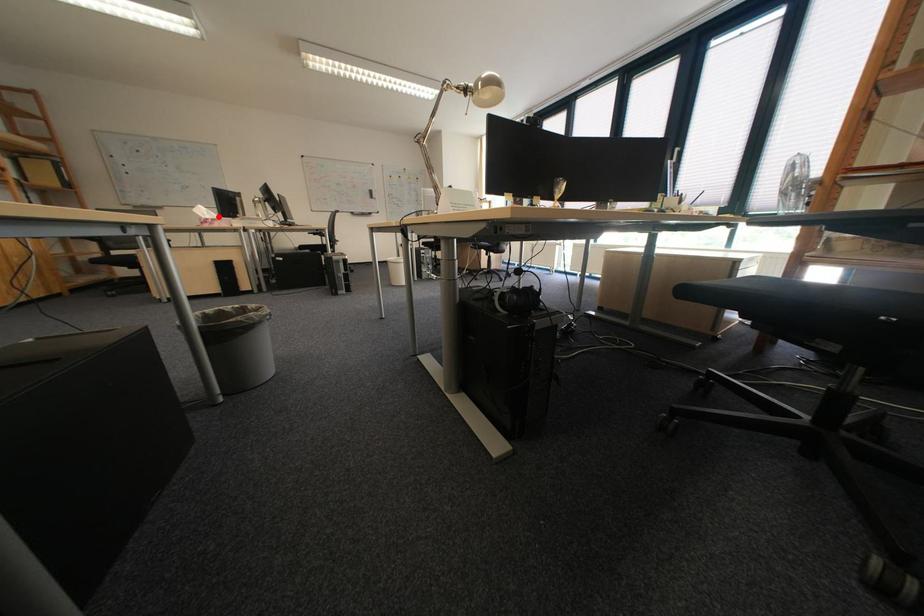
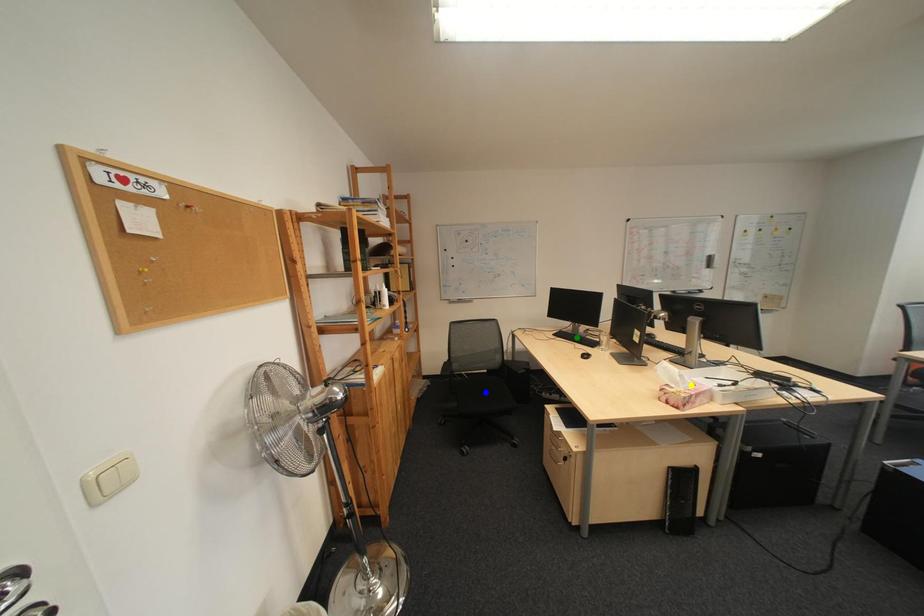
Question: I am providing you with two images of the same scene from different viewpoints. A red point is marked on the first image. You are given multiple points on the second image. Which point in image 2 represents the same 3d spot as the red point in image 1?

Choices:
 (A) green point
 (B) blue point
 (C) yellow point

Answer: (C)